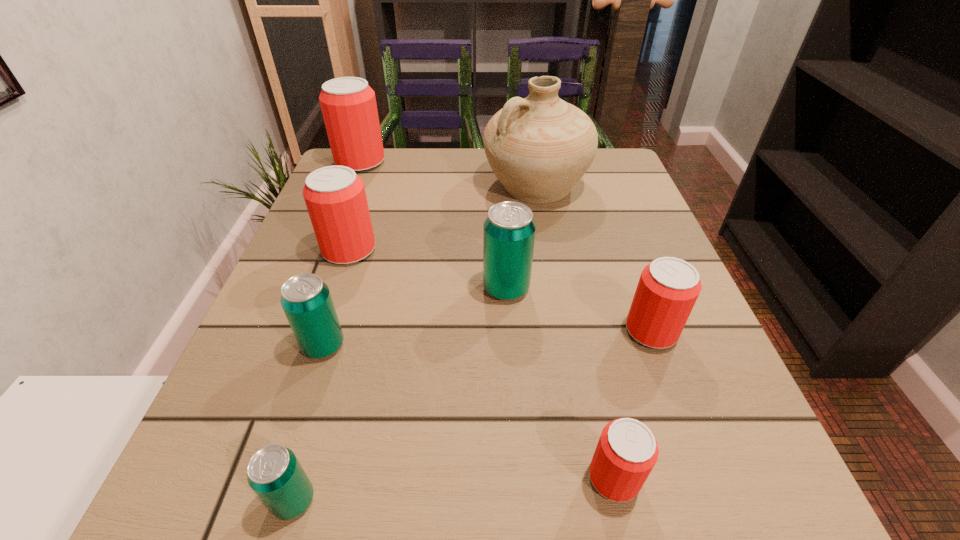
This screenshot has width=960, height=540. In order to click on empty space that is in between the pottery and the nearest teal beer can in this screenshot , I will do `click(415, 343)`.

You are a GUI agent. You are given a task and a screenshot of the screen. Output one action in this format:
    pyautogui.click(x=<x>, y=<y>)
    Task: Click on the unoccupied position between the second farthest beer can and the tallest object
    This screenshot has height=540, width=960.
    Given the screenshot: What is the action you would take?
    pyautogui.click(x=443, y=218)

Find the location of a particular element. The width and height of the screenshot is (960, 540). unoccupied position between the nearest red beer can and the tallest object is located at coordinates point(575,332).

The image size is (960, 540). I want to click on object that ranks as the fifth closest to the farthest beer can, so click(668, 288).

Choose which object is the second nearest neighbor to the nearest teal beer can. Please provide its 2D coordinates. Your answer should be formatted as a tuple, i.e. [(x, y)], where the tuple contains the x and y coordinates of a point satisfying the conditions above.

[(627, 451)]

Choose which beer can is the fifth nearest neighbor to the second nearest teal beer can. Please provide its 2D coordinates. Your answer should be formatted as a tuple, i.e. [(x, y)], where the tuple contains the x and y coordinates of a point satisfying the conditions above.

[(668, 288)]

Identify the location of beer can that stands as the sixth closest to the sixth nearest beer can. (627, 451).

The image size is (960, 540). I want to click on red beer can that can be found as the fourth closest to the smallest teal beer can, so click(348, 104).

Identify which red beer can is the nearest to the third smallest red beer can. Please provide its 2D coordinates. Your answer should be formatted as a tuple, i.e. [(x, y)], where the tuple contains the x and y coordinates of a point satisfying the conditions above.

[(348, 104)]

Where is `the second closest teal beer can to the second biggest teal beer can`? The width and height of the screenshot is (960, 540). the second closest teal beer can to the second biggest teal beer can is located at coordinates (509, 230).